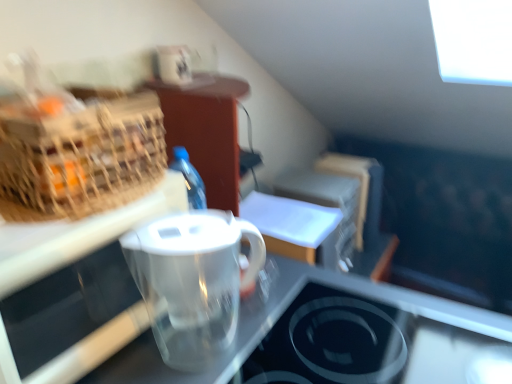
Question: Visually, is transparent plastic pitcher at center positioned to the left or to the right of transparent glass stovetop at lower center?

Choices:
 (A) right
 (B) left

Answer: (B)

Question: Considering their positions, is transparent plastic pitcher at center located in front of or behind transparent glass stovetop at lower center?

Choices:
 (A) behind
 (B) front

Answer: (A)

Question: Which object is positioned farthest from the transparent plastic pitcher at center?

Choices:
 (A) transparent glass stovetop at lower center
 (B) transparent plastic pitcher at center
 (C) woven straw picnic basket at left

Answer: (A)

Question: Based on their relative distances, which object is nearer to the transparent plastic pitcher at center?

Choices:
 (A) transparent glass stovetop at lower center
 (B) transparent plastic pitcher at center
 (C) woven straw picnic basket at left

Answer: (C)